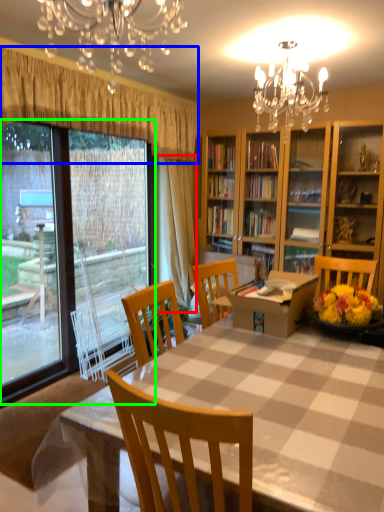
Question: Based on their relative distances, which object is nearer to curtain (highlighted by a red box)? Choose from curtain (highlighted by a blue box) and bay window (highlighted by a green box).

Choices:
 (A) curtain
 (B) bay window

Answer: (A)